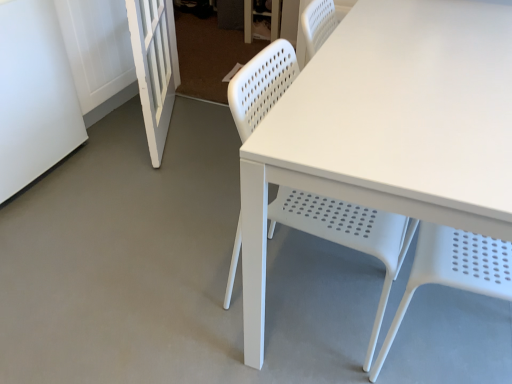
Question: From a real-world perspective, is white plastic chair at center physically located above or below white matte screen door at left, positioned as the second screen door in left-to-right order?

Choices:
 (A) above
 (B) below

Answer: (A)

Question: Choose the correct answer: Is white plastic chair at center inside white matte screen door at left, positioned as the second screen door in left-to-right order, or outside it?

Choices:
 (A) outside
 (B) inside

Answer: (A)

Question: Considering the real-world distances, which object is farthest from the white matte screen door at left, the first screen door positioned from the left?

Choices:
 (A) white matte screen door at left, positioned as the second screen door in left-to-right order
 (B) white plastic chair at center

Answer: (B)

Question: Which object is the closest to the white plastic chair at center?

Choices:
 (A) white matte screen door at left, positioned as the second screen door in left-to-right order
 (B) white matte screen door at left, the first screen door positioned from the left

Answer: (A)